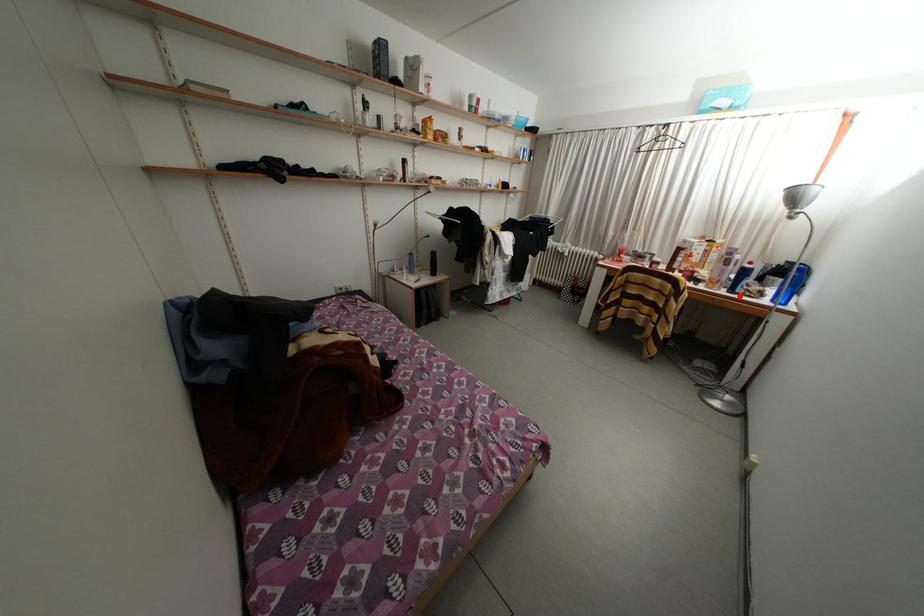
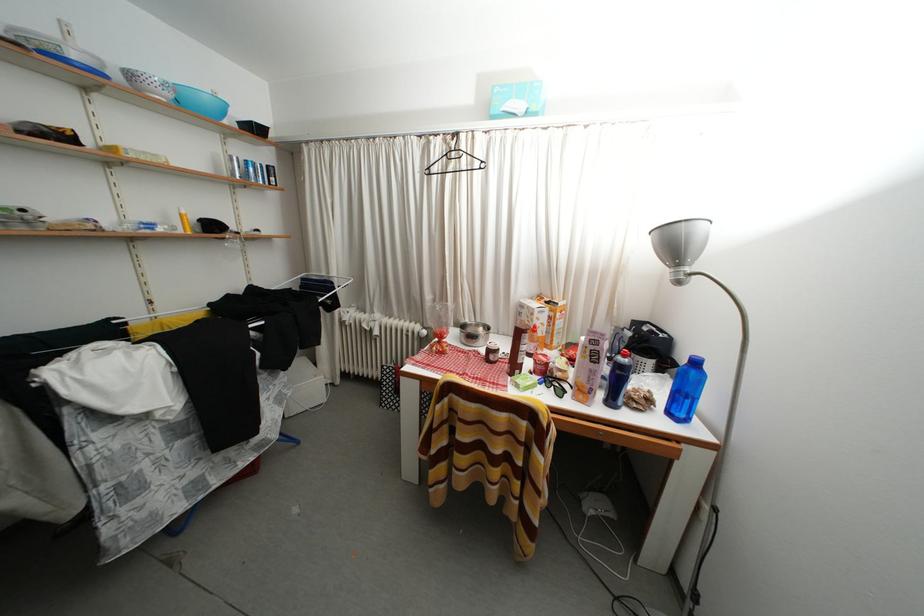
Locate, in the second image, the point that corresponds to the highlighted location in the first image.

(618, 408)